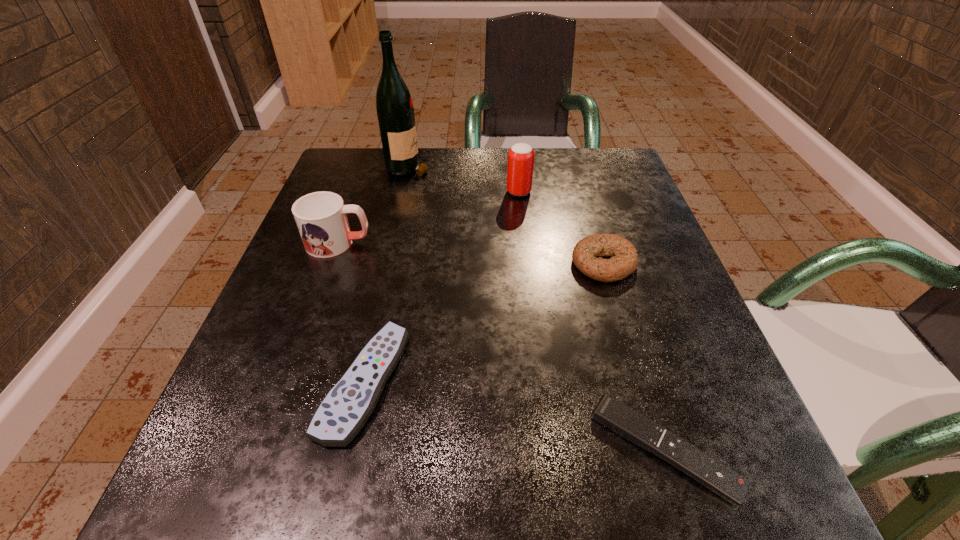
In order to click on vacant area that lies between the shorter remote control and the third tallest object in this screenshot , I will do `click(501, 346)`.

At what (x,y) coordinates should I click in order to perform the action: click on unoccupied position between the farthest object and the third tallest object. Please return your answer as a coordinate pair (x, y). Image resolution: width=960 pixels, height=540 pixels. Looking at the image, I should click on (373, 205).

You are a GUI agent. You are given a task and a screenshot of the screen. Output one action in this format:
    pyautogui.click(x=<x>, y=<y>)
    Task: Click on the free area in between the left remote control and the second farthest object
    
    Given the screenshot: What is the action you would take?
    pyautogui.click(x=442, y=287)

This screenshot has height=540, width=960. I want to click on free area in between the bagel and the wine bottle, so click(x=506, y=214).

Identify the location of object that is the fourth closest to the fifth tallest object. (520, 166).

In order to click on object that ranks as the fifth closest to the mug in this screenshot , I will do `click(630, 424)`.

The width and height of the screenshot is (960, 540). I want to click on vacant area that satisfies the following two spatial constraints: 1. on the side of the shortest object with the handle; 2. on the left side of the mug, so click(x=264, y=449).

Image resolution: width=960 pixels, height=540 pixels. What are the coordinates of `free spot that satisfies the following two spatial constraints: 1. on the side of the bagel with the handle; 2. on the right side of the third tallest object` in the screenshot? It's located at (331, 264).

You are a GUI agent. You are given a task and a screenshot of the screen. Output one action in this format:
    pyautogui.click(x=<x>, y=<y>)
    Task: Click on the blank area in the image that satisfies the following two spatial constraints: 1. on the back side of the third shortest object; 2. on the side of the fourth shortest object with the handle
    
    Given the screenshot: What is the action you would take?
    pyautogui.click(x=597, y=243)

The image size is (960, 540). What are the coordinates of `free space that satisfies the following two spatial constraints: 1. on the front side of the wine bottle; 2. on the side of the mug with the handle` in the screenshot? It's located at (391, 243).